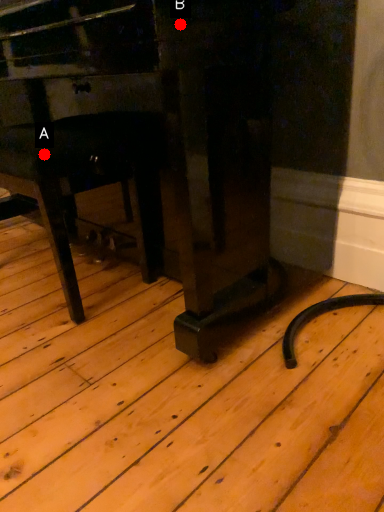
Question: Two points are circled on the image, labeled by A and B beside each circle. Which point is closer to the camera taking this photo?

Choices:
 (A) A is closer
 (B) B is closer

Answer: (B)